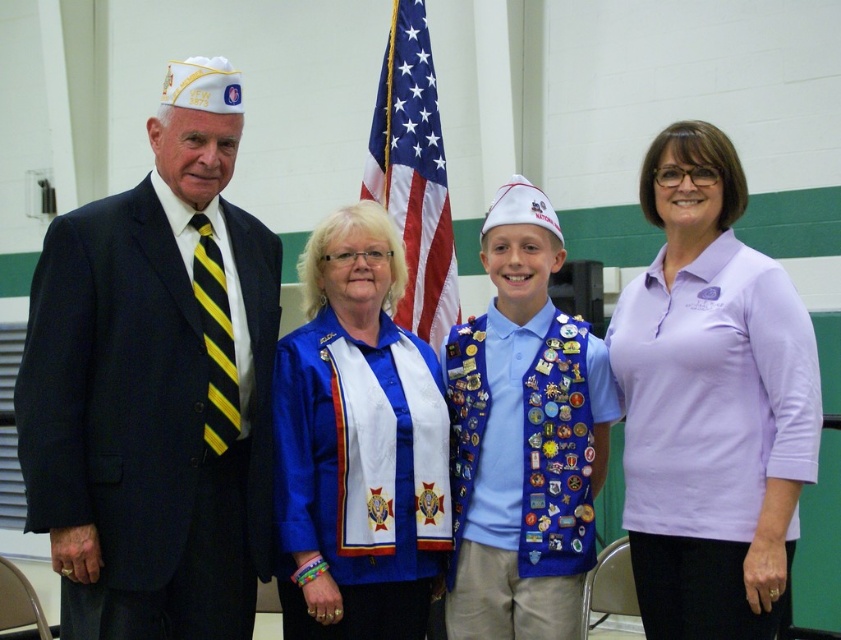
You are a photographer adjusting your camera settings to focus on the two sashes worn by the woman in the middle. Which sash, the blue satin sash at center or the blue velvet sash at center, is positioned closer to the camera?

The blue satin sash at center is closer to the viewer than the blue velvet sash at center, so the blue satin sash at center is positioned closer to the camera.

You are organizing a charity event and need to decide which item to display first between the lavender cotton polo shirt at center and the blue velvet sash at center. Based on their sizes, which one should be placed first?

The lavender cotton polo shirt at center has a larger size compared to the blue velvet sash at center, so it should be displayed first.